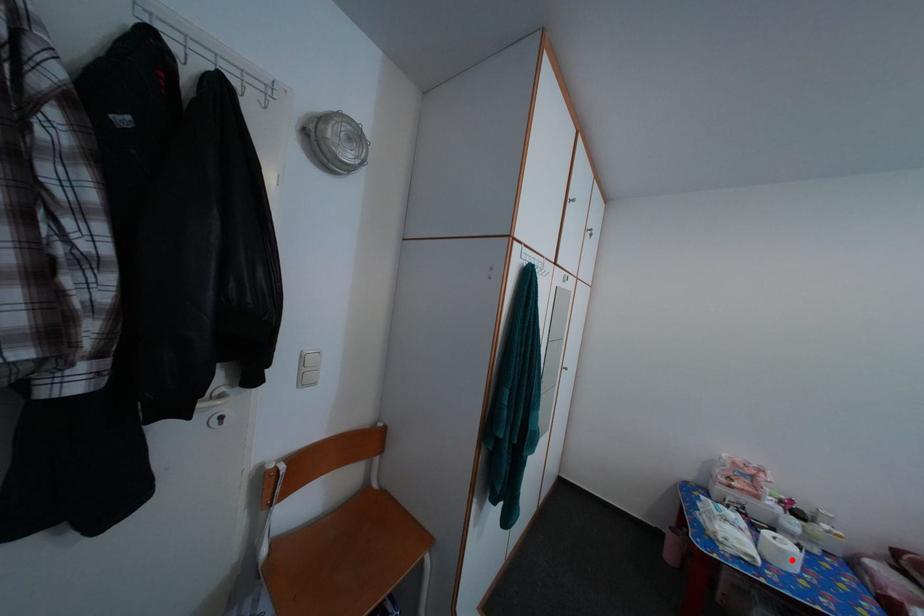
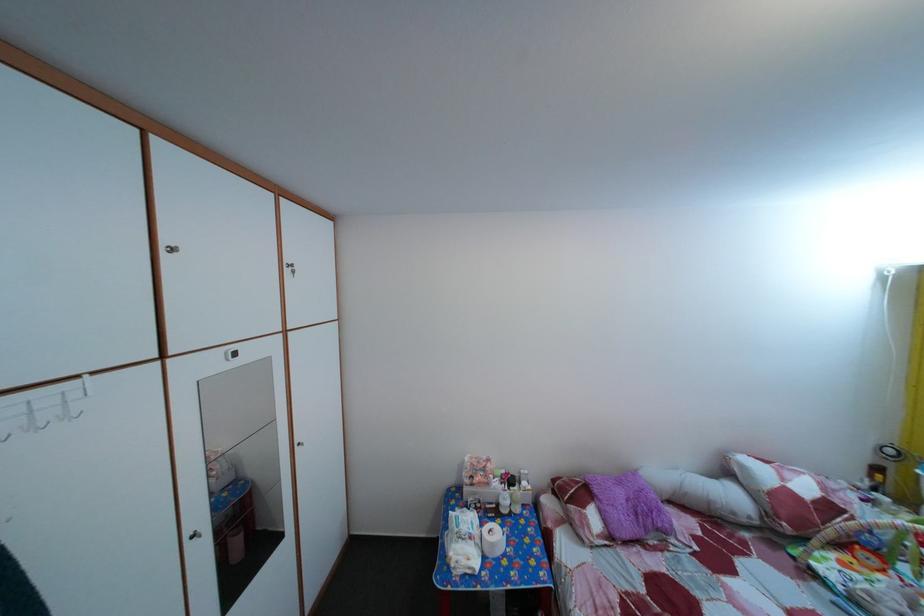
In the second image, find the point that corresponds to the highlighted location in the first image.

(502, 553)